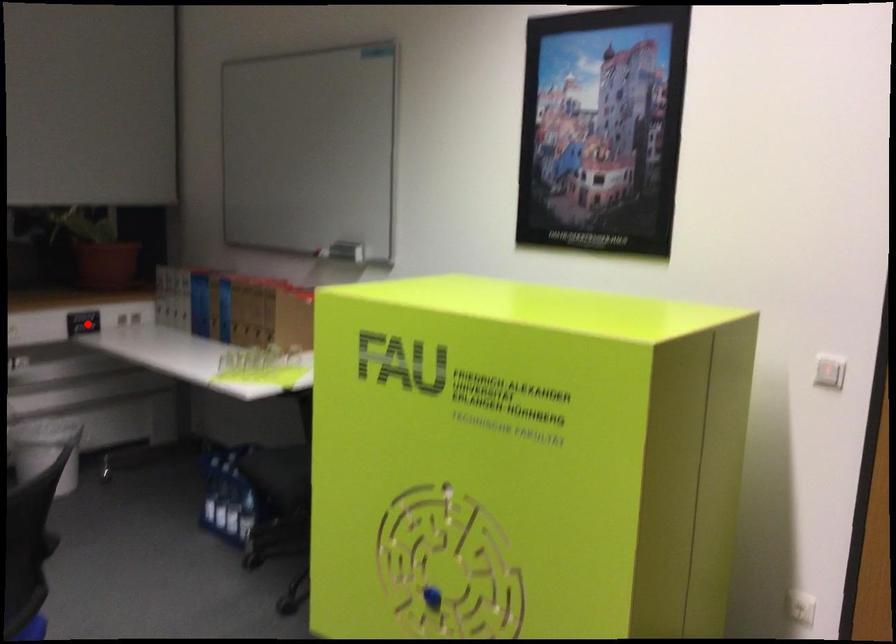
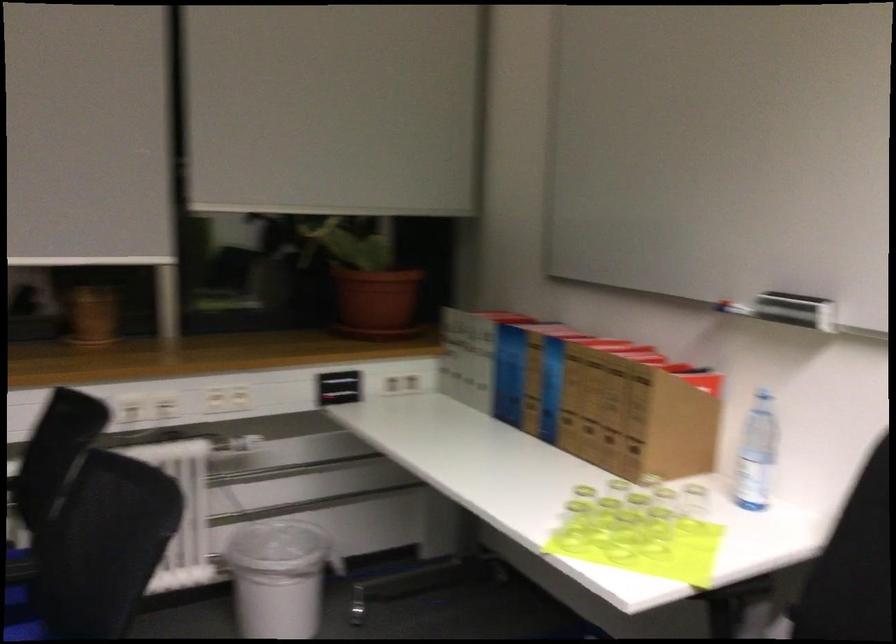
Question: A red point is marked in image1. In image2, is the corresponding 3D point closer to the camera or farther? Reply with the corresponding letter.

Choices:
 (A) The corresponding 3D point is closer.
 (B) The corresponding 3D point is farther.

Answer: (A)